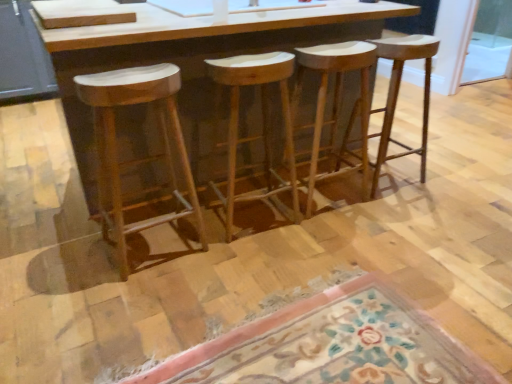
Find the location of `vacant area on top of natural wood stool at center, the 1th stool from the right (from a real-world perspective)`. vacant area on top of natural wood stool at center, the 1th stool from the right (from a real-world perspective) is located at coordinates [x=399, y=37].